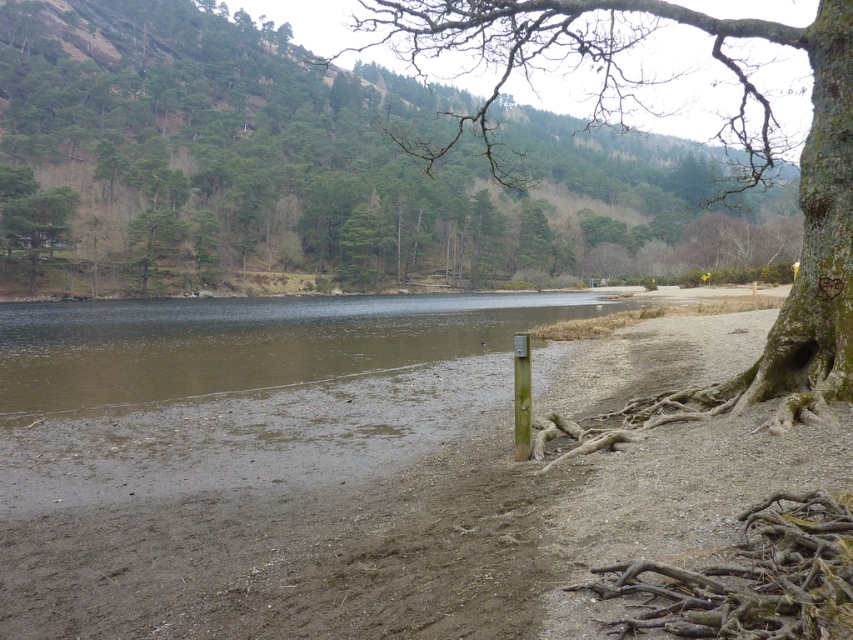
Based on the photo, is brown/muddy water at center shorter than green metallic pole at center?

No, brown/muddy water at center is not shorter than green metallic pole at center.

Is point (258, 310) closer to viewer compared to point (523, 419)?

No, (258, 310) is further to viewer.

Locate an element on the screen. brown/muddy water at center is located at coordinates (247, 342).

Can you confirm if bark textured tree at center right is shorter than green metallic pole at center?

Incorrect, bark textured tree at center right's height does not fall short of green metallic pole at center's.

Between bark textured tree at center right and green metallic pole at center, which one is positioned lower?

green metallic pole at center is lower down.

Is point (532, 44) in front of point (521, 429)?

No, it is behind (521, 429).

Identify the location of bark textured tree at center right. The height and width of the screenshot is (640, 853). (718, 132).

Which is above, brown/muddy water at center or brown rough tree roots at lower right?

Positioned higher is brown/muddy water at center.

Does brown/muddy water at center appear under brown rough tree roots at lower right?

Incorrect, brown/muddy water at center is not positioned below brown rough tree roots at lower right.

Find the location of a particular element. The image size is (853, 640). brown/muddy water at center is located at coordinates tap(247, 342).